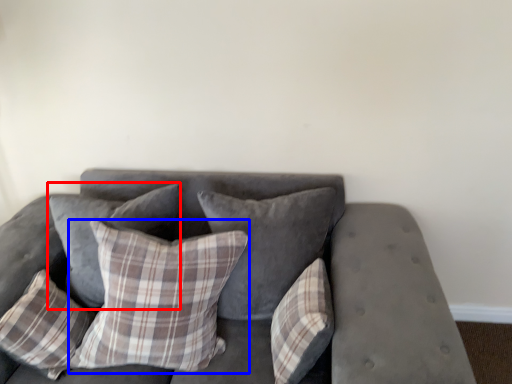
Question: Among these objects, which one is farthest to the camera, pillow (highlighted by a red box) or pillow (highlighted by a blue box)?

Choices:
 (A) pillow
 (B) pillow

Answer: (A)